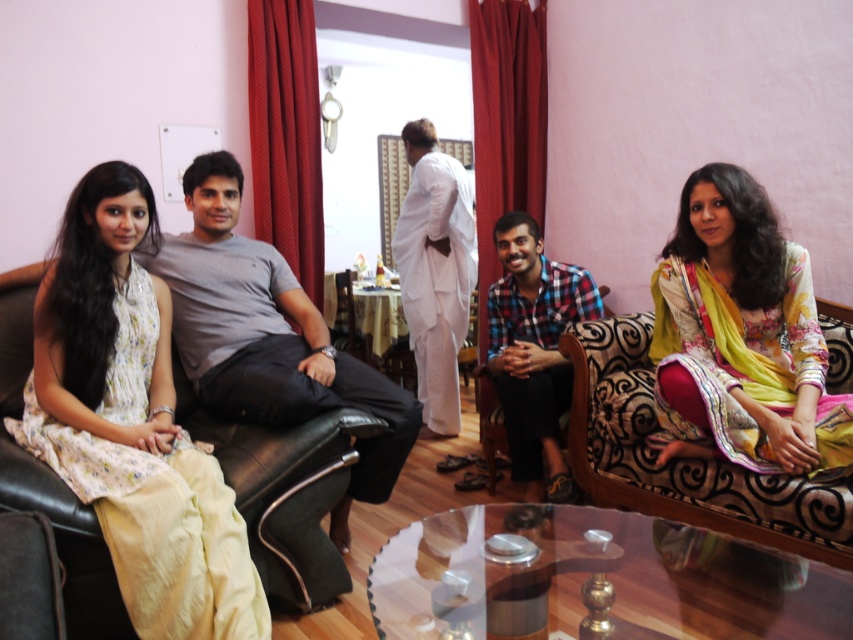
You are organizing a photo shoot and need to place two outfits on a mannequin stand that can only accommodate one outfit at a time. The floral fabric dress at center and the white cotton kurta at center are both on the glass coffee table in the foreground. Which outfit should you pick up first if you want to ensure the wider one is displayed first?

The floral fabric dress at center might be wider than the white cotton kurta at center, so you should pick up the floral fabric dress at center first to display the wider one first.

You are standing at the doorway in the background and want to walk towards the two points marked in the room. Which point would you reach first, point (x=746, y=474) or point (x=515, y=397)?

Point (x=746, y=474) is in front of point (x=515, y=397), so you would reach point (x=746, y=474) first.